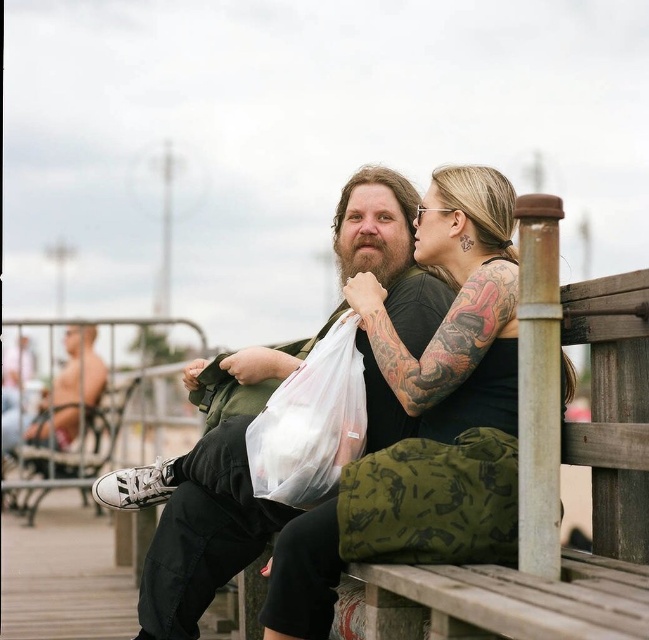
You are a photographer trying to capture the scene. You need to focus on the black matte tank top at center and the white plastic bag at lower left. Which object should you zoom in on first if you want to capture both in the same frame without changing the camera angle?

The black matte tank top at center is bigger than the white plastic bag at lower left, so you should zoom in on the white plastic bag at lower left first to ensure both fit in the frame.

You are a photographer standing at the camera position. You want to take a closeup shot of the black matte tank top at center. Considering the distance, do you think you can focus on it clearly without moving the camera?

The black matte tank top at center is 90.26 feet from the camera, so it should be in focus as most cameras can focus clearly at that distance without needing to move.